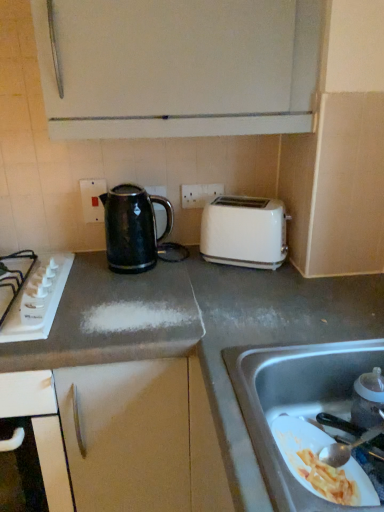
Where is `free spot in front of white glossy toaster at upper right`? The height and width of the screenshot is (512, 384). free spot in front of white glossy toaster at upper right is located at coordinates (x=248, y=287).